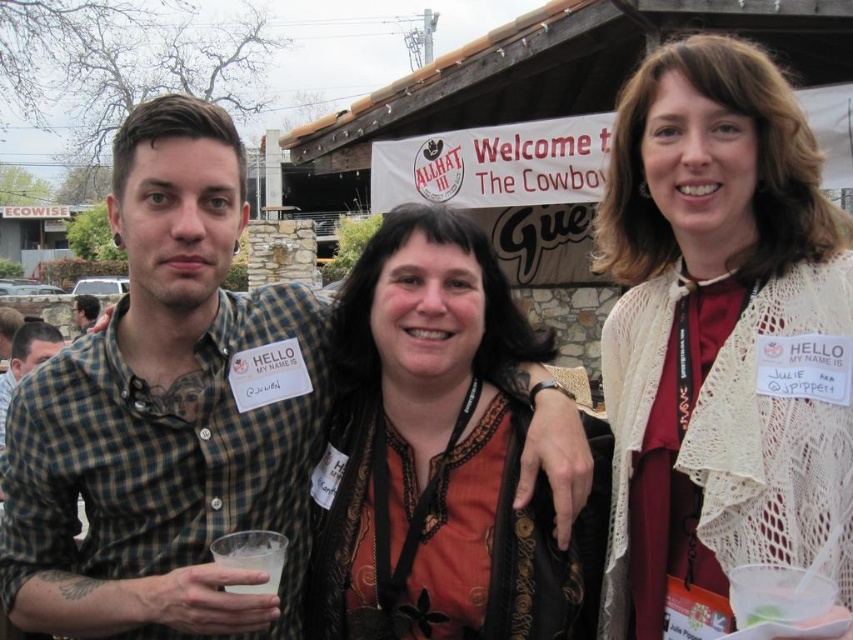
In the scene shown: Based on the scene description, where exactly is the white lace shawl at center located in the image?

The white lace shawl at center is located at point (720, 340).

You are at the event and want to take a photo with both the white lace shawl at center and the orange fabric shirt at center. Which one should you focus on first to ensure both are in the frame?

You should focus on the orange fabric shirt at center first since the white lace shawl at center is to the right of it, ensuring both are in the frame by centering on the shirt and adjusting to include the shawl to the right.